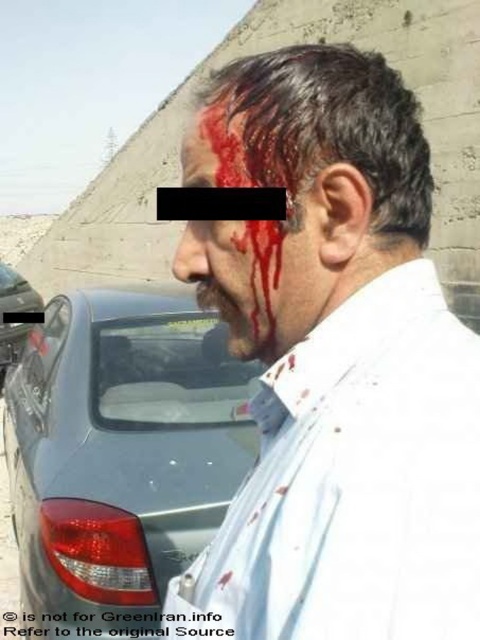
Question: Is white matte shirt at center above blood-stained skin at center?

Choices:
 (A) yes
 (B) no

Answer: (B)

Question: Is the position of matte gray car at left more distant than that of blood-stained skin at center?

Choices:
 (A) no
 (B) yes

Answer: (B)

Question: Which point is closer to the camera taking this photo?

Choices:
 (A) (208, 148)
 (B) (268, 563)
 (C) (107, 365)
 (D) (29, 305)

Answer: (B)

Question: Which point is farther to the camera?

Choices:
 (A) (2, 312)
 (B) (211, 144)
 (C) (233, 396)
 (D) (342, 528)

Answer: (A)

Question: Where is matte gray car at left located in relation to blood-stained skin at center in the image?

Choices:
 (A) left
 (B) right

Answer: (A)

Question: Which of the following is the closest to the observer?

Choices:
 (A) blood-stained skin at center
 (B) metallic silver car at left

Answer: (A)